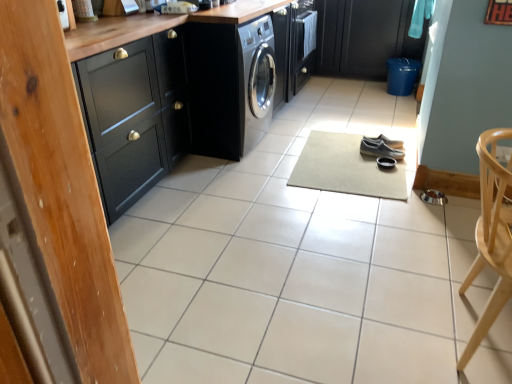
Question: In terms of width, does black leather shoes at center, which is counted as the 2th footwear, starting from the front, look wider or thinner when compared to beige carpet at center?

Choices:
 (A) wide
 (B) thin

Answer: (B)

Question: From a real-world perspective, is black leather shoes at center, which is counted as the 2th footwear, starting from the front, positioned above or below beige carpet at center?

Choices:
 (A) above
 (B) below

Answer: (A)

Question: Which object is the closest to the black leather shoes at center, which is counted as the 2th footwear, starting from the front?

Choices:
 (A) black matte cabinet at left, positioned as the second cabinetry in right-to-left order
 (B) black matte cabinet at upper right, which is the 1th cabinetry from right to left
 (C) beige carpet at center
 (D) dark grey canvas shoes at center, the second footwear when ordered from back to front
 (E) satin black washing machine at center

Answer: (D)

Question: Considering the real-world distances, which object is closest to the beige carpet at center?

Choices:
 (A) dark grey canvas shoes at center, the second footwear when ordered from back to front
 (B) black matte cabinet at left, which is the first cabinetry in bottom-to-top order
 (C) black matte cabinet at upper right, marked as the first cabinetry in a back-to-front arrangement
 (D) black leather shoes at center, which is counted as the 2th footwear, starting from the front
 (E) satin black washing machine at center

Answer: (A)